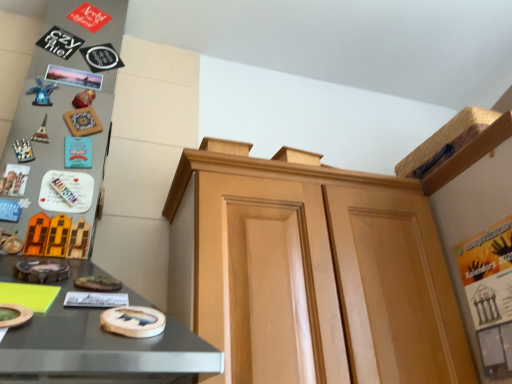
Question: Considering the relative sizes of light brown wood cabinet at center and blue plastic windmill at left in the image provided, is light brown wood cabinet at center bigger than blue plastic windmill at left?

Choices:
 (A) no
 (B) yes

Answer: (B)

Question: Does light brown wood cabinet at center turn towards blue plastic windmill at left?

Choices:
 (A) no
 (B) yes

Answer: (A)

Question: Is light brown wood cabinet at center positioned behind blue plastic windmill at left?

Choices:
 (A) no
 (B) yes

Answer: (A)

Question: Is light brown wood cabinet at center in front of blue plastic windmill at left?

Choices:
 (A) no
 (B) yes

Answer: (B)

Question: Considering the relative sizes of light brown wood cabinet at center and blue plastic windmill at left in the image provided, is light brown wood cabinet at center smaller than blue plastic windmill at left?

Choices:
 (A) no
 (B) yes

Answer: (A)

Question: Can you confirm if light brown wood cabinet at center is taller than blue plastic windmill at left?

Choices:
 (A) no
 (B) yes

Answer: (B)

Question: Considering the relative sizes of blue plastic windmill at left and light brown wood cabinet at center in the image provided, is blue plastic windmill at left shorter than light brown wood cabinet at center?

Choices:
 (A) no
 (B) yes

Answer: (B)

Question: Can you confirm if blue plastic windmill at left is positioned to the right of light brown wood cabinet at center?

Choices:
 (A) no
 (B) yes

Answer: (A)

Question: From a real-world perspective, is blue plastic windmill at left on top of light brown wood cabinet at center?

Choices:
 (A) no
 (B) yes

Answer: (B)

Question: Is blue plastic windmill at left not near light brown wood cabinet at center?

Choices:
 (A) yes
 (B) no

Answer: (B)

Question: Is blue plastic windmill at left facing away from light brown wood cabinet at center?

Choices:
 (A) no
 (B) yes

Answer: (A)

Question: Considering the relative positions of blue plastic windmill at left and light brown wood cabinet at center in the image provided, is blue plastic windmill at left in front of light brown wood cabinet at center?

Choices:
 (A) no
 (B) yes

Answer: (A)

Question: Based on their sizes in the image, would you say blue plastic windmill at left is bigger or smaller than light brown wood cabinet at center?

Choices:
 (A) big
 (B) small

Answer: (B)